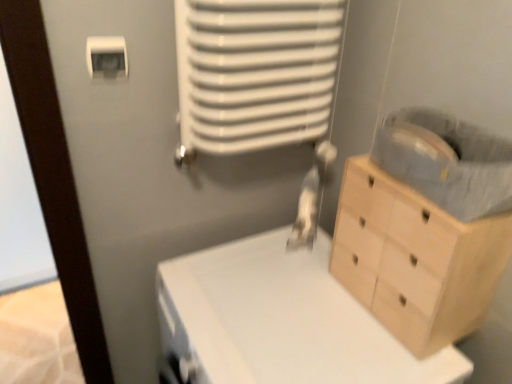
This screenshot has width=512, height=384. Describe the element at coordinates (106, 56) in the screenshot. I see `white plastic light switch at upper left` at that location.

This screenshot has height=384, width=512. In order to click on white matte changing table at center in this screenshot , I will do `click(279, 321)`.

Measure the distance between point (x=238, y=307) and camera.

Point (x=238, y=307) and camera are 39.06 inches apart from each other.

Identify the location of white plastic light switch at upper left. The image size is (512, 384). (106, 56).

Which is more to the right, light wood chest of drawers at right or white plastic light switch at upper left?

light wood chest of drawers at right.

Is light wood chest of drawers at right wider or thinner than white plastic light switch at upper left?

Clearly, light wood chest of drawers at right has more width compared to white plastic light switch at upper left.

Is light wood chest of drawers at right not near white plastic light switch at upper left?

No, light wood chest of drawers at right is in close proximity to white plastic light switch at upper left.

Can you tell me how much light wood chest of drawers at right and white plastic light switch at upper left differ in facing direction?

90 degrees separate the facing orientations of light wood chest of drawers at right and white plastic light switch at upper left.

Which is less distant, [402,373] or [348,184]?

The point [402,373] is in front.

Considering the positions of objects white matte changing table at center and light wood chest of drawers at right in the image provided, who is more to the right, white matte changing table at center or light wood chest of drawers at right?

light wood chest of drawers at right.

Looking at this image, from a real-world perspective, is white matte changing table at center physically located above or below light wood chest of drawers at right?

white matte changing table at center is situated lower than light wood chest of drawers at right in the real world.

Consider the image. From the image's perspective, which one is positioned lower, white matte changing table at center or light wood chest of drawers at right?

white matte changing table at center.

Between white plastic light switch at upper left and white matte changing table at center, which one appears on the left side from the viewer's perspective?

white plastic light switch at upper left is more to the left.

This screenshot has height=384, width=512. Identify the location of changing table that appears on the right of white plastic light switch at upper left. (279, 321).

Is white plastic light switch at upper left touching white matte changing table at center?

No, white plastic light switch at upper left is not making contact with white matte changing table at center.

Considering the sizes of objects light wood chest of drawers at right and white matte changing table at center in the image provided, who is taller, light wood chest of drawers at right or white matte changing table at center?

white matte changing table at center is taller.

Between point (385, 217) and point (237, 314), which one is positioned behind?

The point (237, 314) is farther.

Image resolution: width=512 pixels, height=384 pixels. I want to click on changing table beneath the light wood chest of drawers at right (from a real-world perspective), so click(279, 321).

Can we say light wood chest of drawers at right lies outside white matte changing table at center?

That's correct, light wood chest of drawers at right is outside of white matte changing table at center.

Is white matte changing table at center spatially inside white plastic light switch at upper left, or outside of it?

white matte changing table at center cannot be found inside white plastic light switch at upper left.

Is white matte changing table at center not near white plastic light switch at upper left?

No, white matte changing table at center is in close proximity to white plastic light switch at upper left.

Consider the image. Between white matte changing table at center and white plastic light switch at upper left, which one has more height?

With more height is white matte changing table at center.

Can you confirm if white matte changing table at center is positioned to the right of white plastic light switch at upper left?

Yes, white matte changing table at center is to the right of white plastic light switch at upper left.

Which object is further away from the camera, white plastic light switch at upper left or light wood chest of drawers at right?

white plastic light switch at upper left.

How much distance is there between white plastic light switch at upper left and light wood chest of drawers at right?

white plastic light switch at upper left and light wood chest of drawers at right are 28.68 inches apart from each other.

Which of these two, white plastic light switch at upper left or light wood chest of drawers at right, is wider?

light wood chest of drawers at right.

Is white plastic light switch at upper left to the left or to the right of light wood chest of drawers at right in the image?

In the image, white plastic light switch at upper left appears on the left side of light wood chest of drawers at right.

There is a light wood chest of drawers at right. Where is `light switch above it (from a real-world perspective)`? light switch above it (from a real-world perspective) is located at coordinates (106, 56).

You are a GUI agent. You are given a task and a screenshot of the screen. Output one action in this format:
    pyautogui.click(x=<x>, y=<y>)
    Task: Click on the changing table that appears in front of the light wood chest of drawers at right
    The image size is (512, 384).
    Given the screenshot: What is the action you would take?
    pyautogui.click(x=279, y=321)

Looking at the image, which one is located closer to white matte changing table at center, light wood chest of drawers at right or white plastic light switch at upper left?

light wood chest of drawers at right lies closer to white matte changing table at center than the other object.

Based on their spatial positions, is light wood chest of drawers at right or white matte changing table at center further from white plastic light switch at upper left?

light wood chest of drawers at right is positioned further to the anchor white plastic light switch at upper left.

Estimate the real-world distances between objects in this image. Which object is further from white matte changing table at center, white plastic light switch at upper left or light wood chest of drawers at right?

white plastic light switch at upper left is positioned further to the anchor white matte changing table at center.

Consider the image. From the image, which object appears to be farther from light wood chest of drawers at right, white matte changing table at center or white plastic light switch at upper left?

white plastic light switch at upper left is positioned further to the anchor light wood chest of drawers at right.

Based on their spatial positions, is white plastic light switch at upper left or white matte changing table at center closer to light wood chest of drawers at right?

The object closer to light wood chest of drawers at right is white matte changing table at center.

Considering their positions, is white matte changing table at center positioned further to white plastic light switch at upper left than light wood chest of drawers at right?

light wood chest of drawers at right.

Locate an element on the screen. The height and width of the screenshot is (384, 512). the chest of drawers between white plastic light switch at upper left and white matte changing table at center vertically is located at coordinates (415, 259).